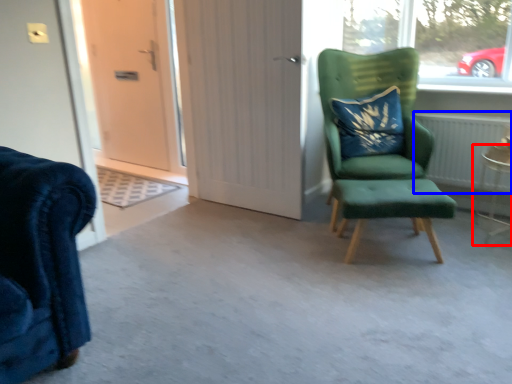
Question: Which point is further to the camera, side table (highlighted by a red box) or radiator (highlighted by a blue box)?

Choices:
 (A) side table
 (B) radiator

Answer: (B)